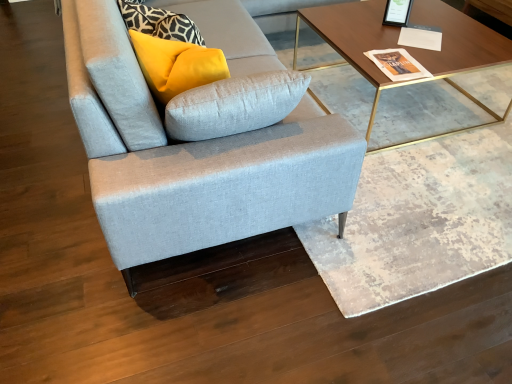
Find the location of a particular element. This screenshot has width=512, height=384. vacant area that is in front of wooden/golden metal legs coffee table at upper right is located at coordinates (430, 198).